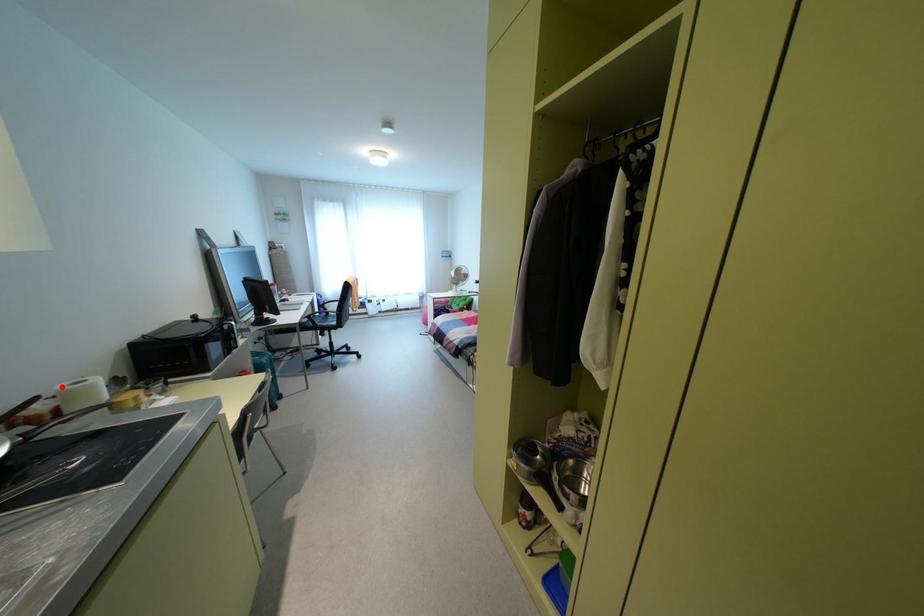
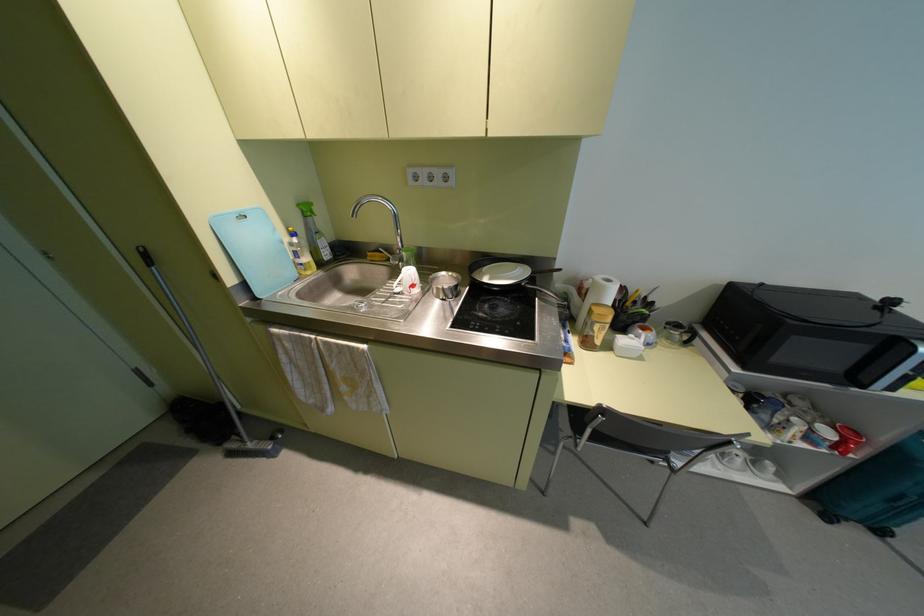
The point at the highlighted location is marked in the first image. Where is the corresponding point in the second image?

(599, 277)